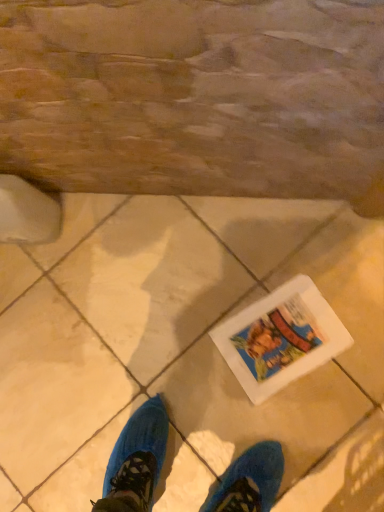
Describe the element at coordinates (281, 338) in the screenshot. I see `white matte comic book at lower center` at that location.

Locate an element on the screen. This screenshot has width=384, height=512. white matte comic book at lower center is located at coordinates (281, 338).

Find the location of a particular element. This screenshot has width=384, height=512. white matte comic book at lower center is located at coordinates (281, 338).